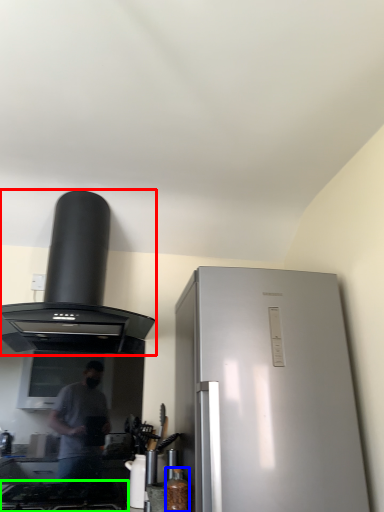
Question: Which is farther away from kitchen appliance (highlighted by a red box)? bottle (highlighted by a blue box) or gas stove (highlighted by a green box)?

Choices:
 (A) bottle
 (B) gas stove

Answer: (A)